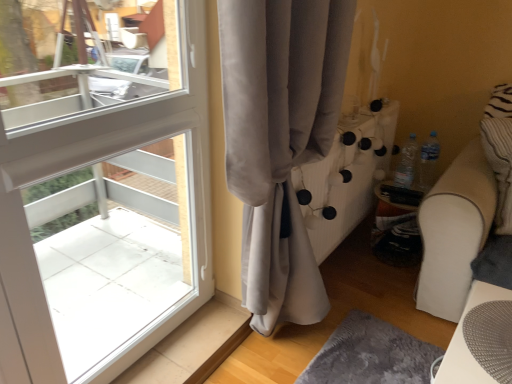
Question: Is satin gray curtain at left facing towards white mesh table at lower right?

Choices:
 (A) no
 (B) yes

Answer: (B)

Question: Does satin gray curtain at left lie behind white mesh table at lower right?

Choices:
 (A) yes
 (B) no

Answer: (B)

Question: From the image's perspective, is satin gray curtain at left under white mesh table at lower right?

Choices:
 (A) no
 (B) yes

Answer: (A)

Question: Is satin gray curtain at left at the right side of white mesh table at lower right?

Choices:
 (A) no
 (B) yes

Answer: (A)

Question: Considering the relative sizes of satin gray curtain at left and white mesh table at lower right in the image provided, is satin gray curtain at left shorter than white mesh table at lower right?

Choices:
 (A) no
 (B) yes

Answer: (A)

Question: Is satin gray curtain at left looking in the opposite direction of white mesh table at lower right?

Choices:
 (A) yes
 (B) no

Answer: (A)

Question: Can you see white mesh table at lower right touching satin gray curtain at left?

Choices:
 (A) no
 (B) yes

Answer: (A)

Question: Is white mesh table at lower right to the left of satin gray curtain at left from the viewer's perspective?

Choices:
 (A) no
 (B) yes

Answer: (A)

Question: From a real-world perspective, is white mesh table at lower right beneath satin gray curtain at left?

Choices:
 (A) no
 (B) yes

Answer: (B)

Question: Does white mesh table at lower right turn towards satin gray curtain at left?

Choices:
 (A) yes
 (B) no

Answer: (B)

Question: Considering the relative sizes of white mesh table at lower right and satin gray curtain at left in the image provided, is white mesh table at lower right bigger than satin gray curtain at left?

Choices:
 (A) yes
 (B) no

Answer: (B)

Question: Does white mesh table at lower right appear on the right side of satin gray curtain at left?

Choices:
 (A) no
 (B) yes

Answer: (B)

Question: In the image, is white mesh table at lower right on the left side or the right side of satin gray curtain at left?

Choices:
 (A) right
 (B) left

Answer: (A)